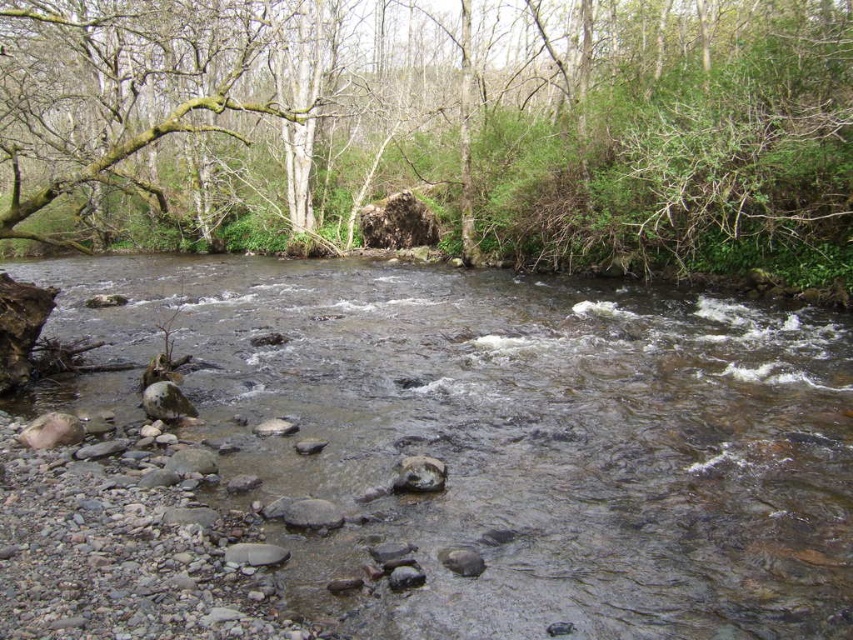
Is green leafy tree at upper center thinner than gray smooth rock at center?

Incorrect, green leafy tree at upper center's width is not less than gray smooth rock at center's.

This screenshot has height=640, width=853. I want to click on green leafy tree at upper center, so click(438, 128).

Locate an element on the screen. The height and width of the screenshot is (640, 853). green leafy tree at upper center is located at coordinates (438, 128).

Between clear water at center and green leafy tree at upper center, which one is positioned higher?

Positioned higher is green leafy tree at upper center.

Can you confirm if clear water at center is positioned to the right of green leafy tree at upper center?

Correct, you'll find clear water at center to the right of green leafy tree at upper center.

Which is behind, point (502, 452) or point (170, 141)?

The point (170, 141) is more distant.

The image size is (853, 640). Find the location of `clear water at center`. clear water at center is located at coordinates (517, 440).

Identify the location of clear water at center. (517, 440).

The height and width of the screenshot is (640, 853). In order to click on clear water at center in this screenshot , I will do `click(517, 440)`.